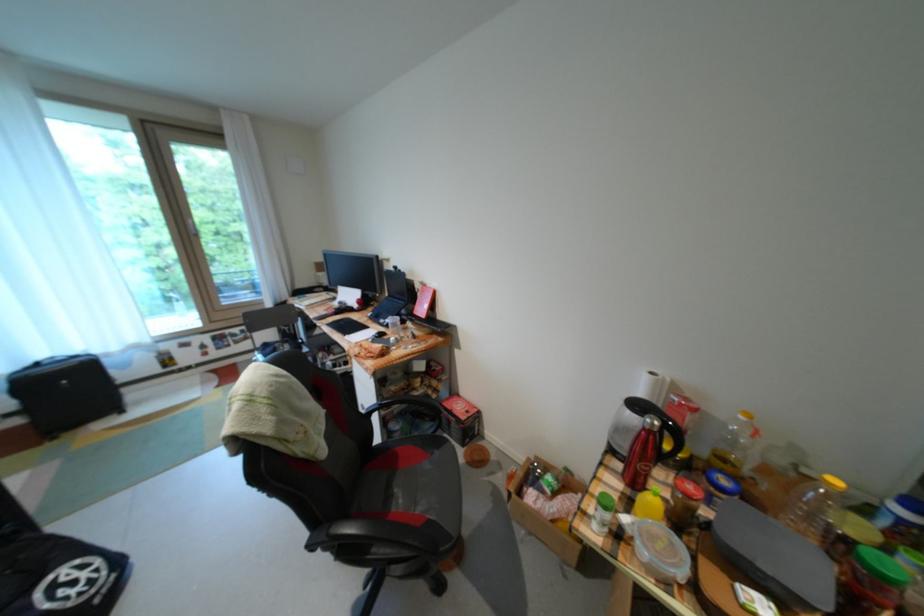
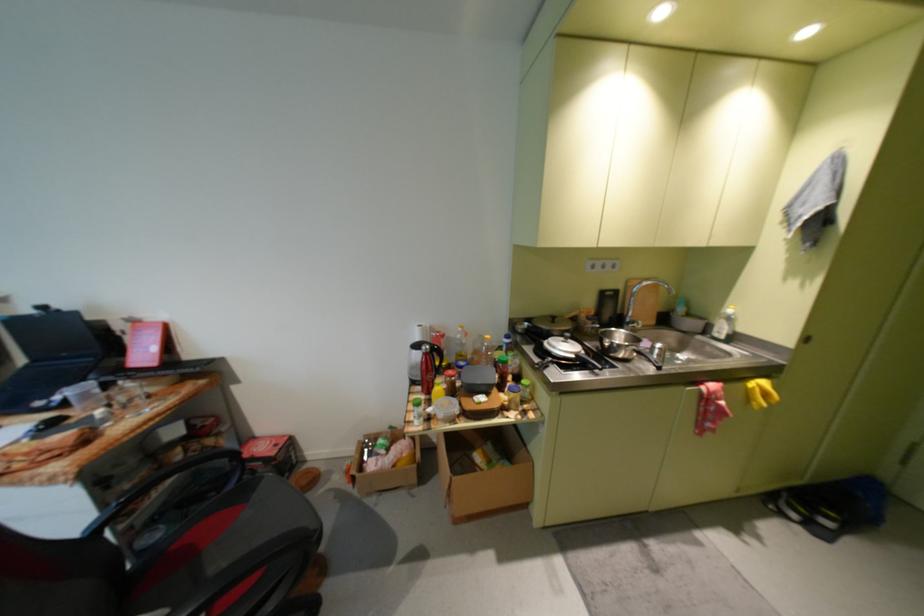
Where in the second image is the point corresponding to pixel 409 336 from the first image?

(119, 407)